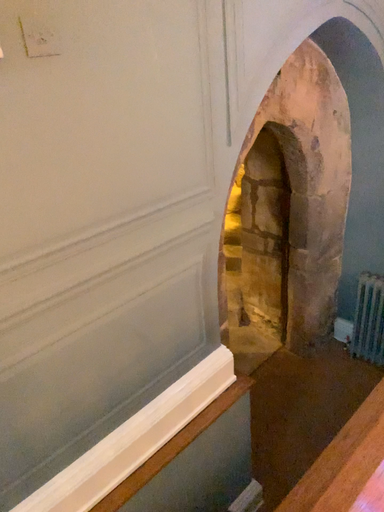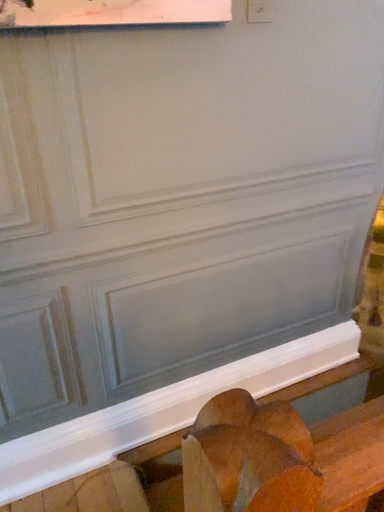
Question: How did the camera likely rotate when shooting the video?

Choices:
 (A) rotated right
 (B) rotated left

Answer: (B)